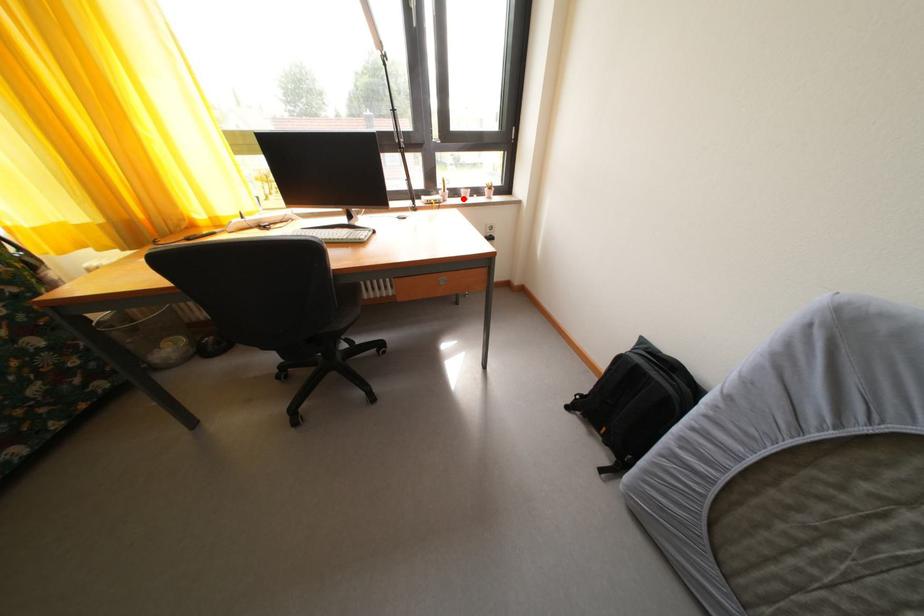
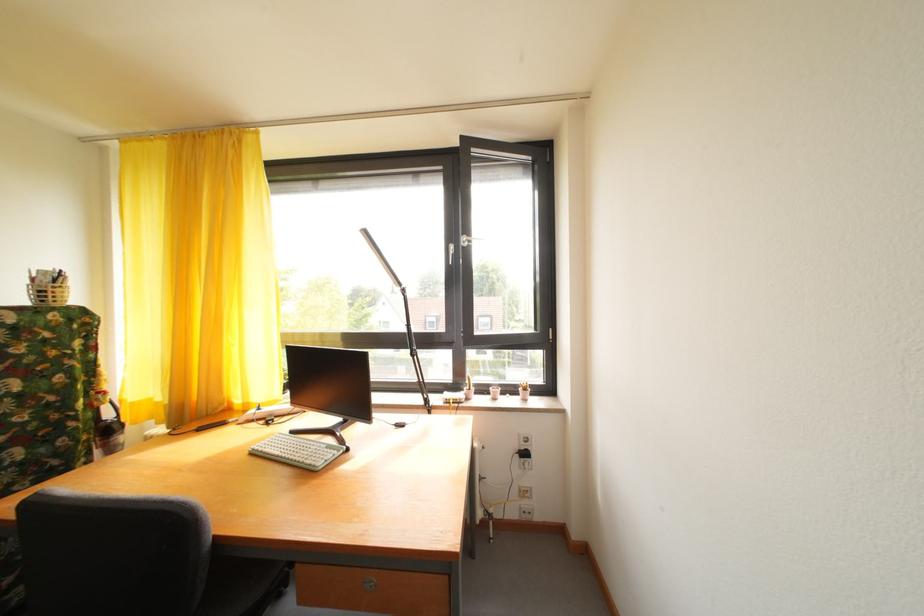
Question: I am providing you with two images of the same scene from different viewpoints. A red point is shown in image1. For the corresponding object point in image2, is it positioned nearer or farther from the camera?

Choices:
 (A) Nearer
 (B) Farther

Answer: (B)